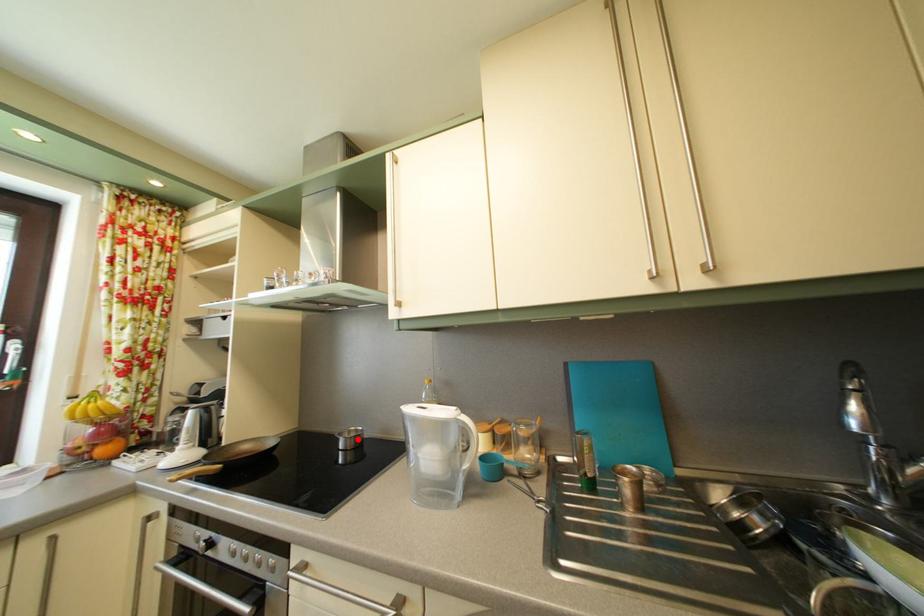
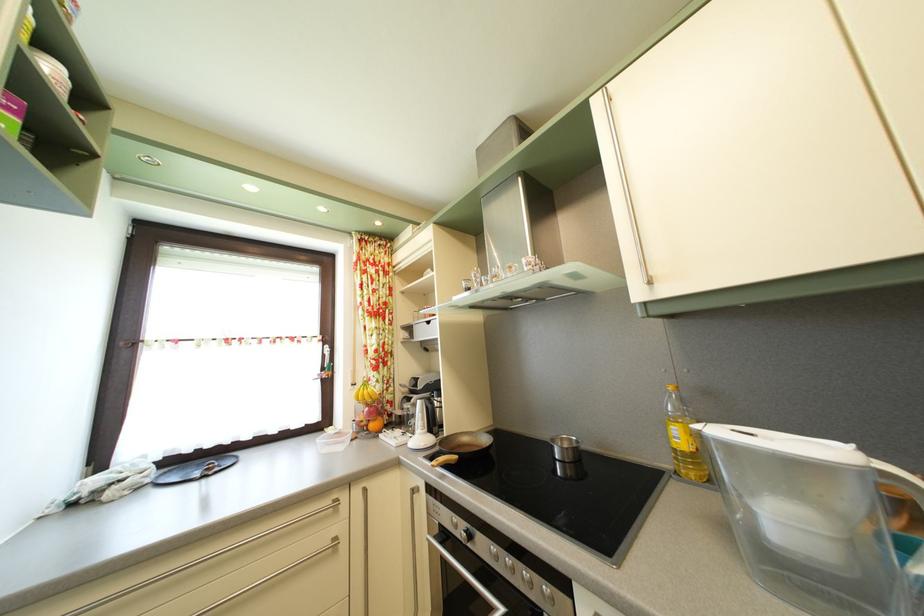
In the second image, find the point that corresponds to the highlighted location in the first image.

(569, 448)